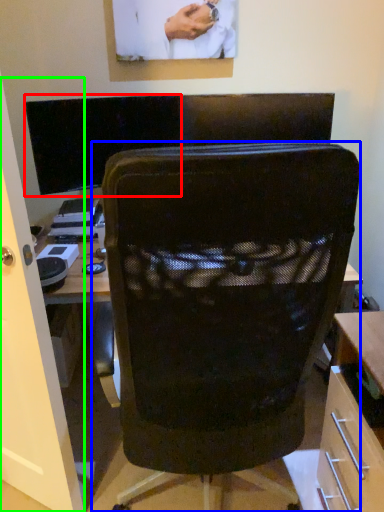
Question: Which is nearer to the computer monitor (highlighted by a red box)? chair (highlighted by a blue box) or glass door (highlighted by a green box).

Choices:
 (A) chair
 (B) glass door

Answer: (B)